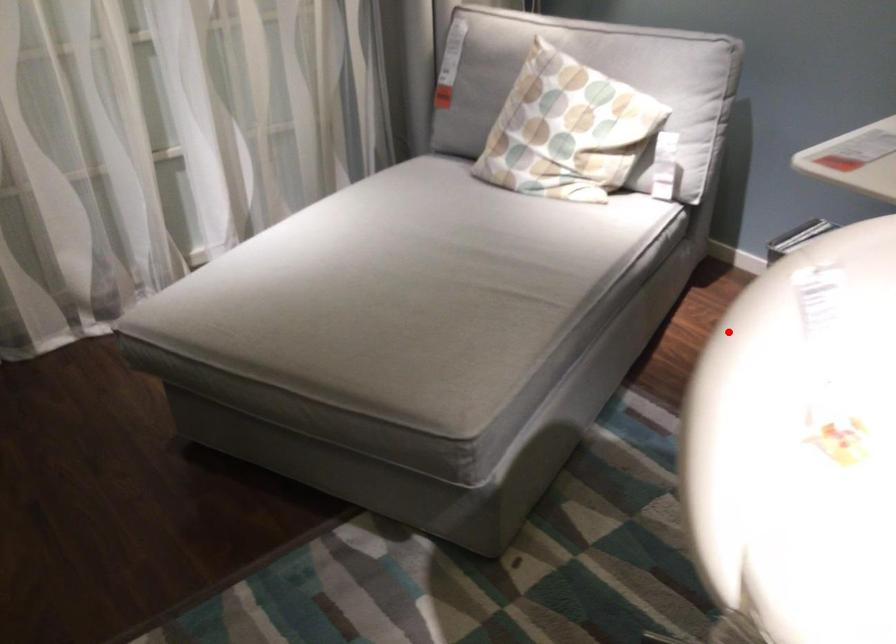
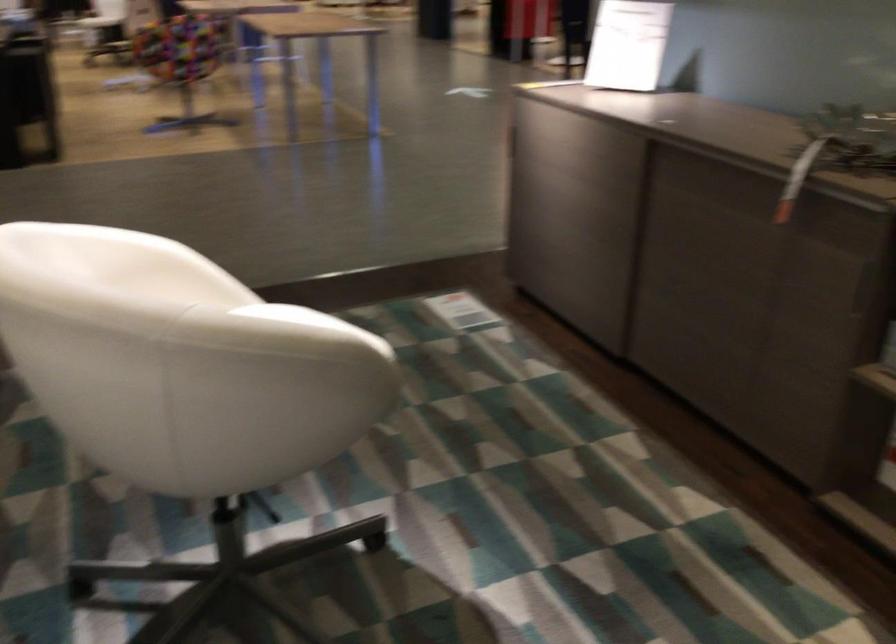
Where in the second image is the point corresponding to the highlighted location from the first image?

(307, 321)